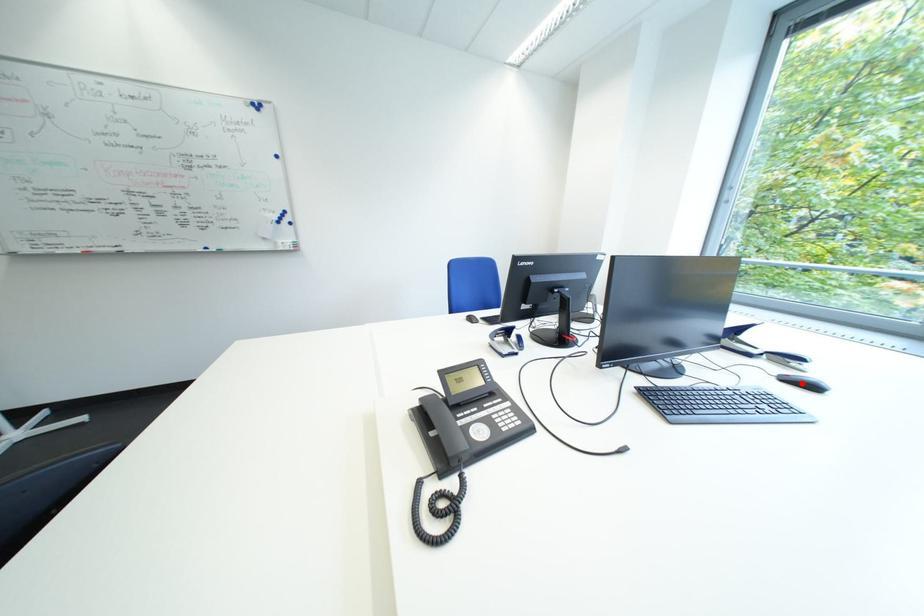
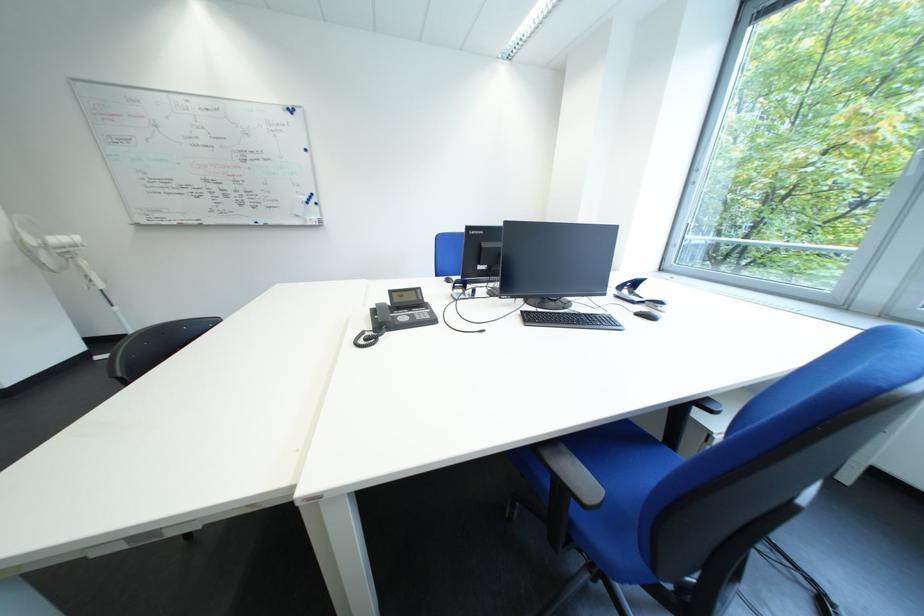
Where in the second image is the point corresponding to the highlighted location from the first image?

(652, 317)